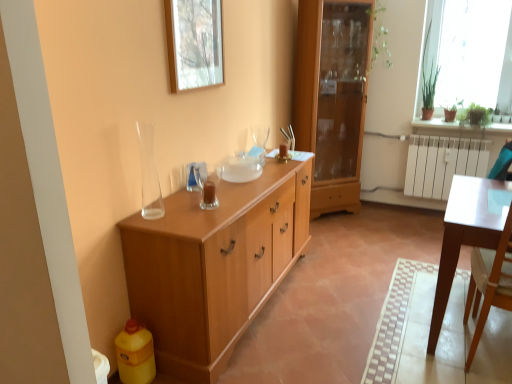
The width and height of the screenshot is (512, 384). I want to click on free space that is to the left of translucent glass candle at center, so click(x=183, y=201).